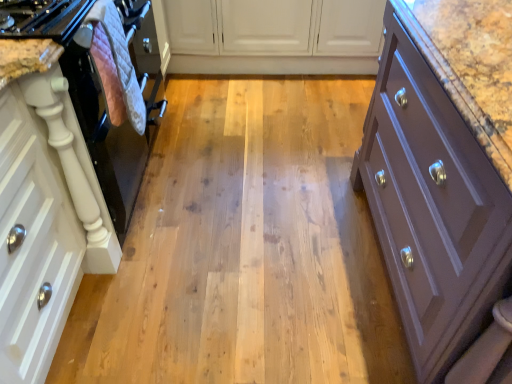
Question: Does pink quilted oven mitt at left have a larger size compared to white matte cabinet at left, which is counted as the third cabinetry, starting from the right?

Choices:
 (A) no
 (B) yes

Answer: (A)

Question: Is pink quilted oven mitt at left oriented away from white matte cabinet at left, which is counted as the first cabinetry, starting from the left?

Choices:
 (A) yes
 (B) no

Answer: (B)

Question: Can you confirm if pink quilted oven mitt at left is wider than white matte cabinet at left, which is counted as the third cabinetry, starting from the right?

Choices:
 (A) yes
 (B) no

Answer: (B)

Question: Is pink quilted oven mitt at left not near white matte cabinet at left, which is counted as the third cabinetry, starting from the right?

Choices:
 (A) yes
 (B) no

Answer: (B)

Question: From a real-world perspective, is pink quilted oven mitt at left located beneath white matte cabinet at left, which is counted as the first cabinetry, starting from the left?

Choices:
 (A) no
 (B) yes

Answer: (A)

Question: Looking at their shapes, would you say black glossy oven at left is wider or thinner than white matte cabinet at left, which is counted as the third cabinetry, starting from the right?

Choices:
 (A) wide
 (B) thin

Answer: (A)

Question: Based on their positions, is black glossy oven at left located to the left or right of white matte cabinet at left, which is counted as the third cabinetry, starting from the right?

Choices:
 (A) left
 (B) right

Answer: (B)

Question: Choose the correct answer: Is black glossy oven at left inside white matte cabinet at left, which is counted as the third cabinetry, starting from the right, or outside it?

Choices:
 (A) outside
 (B) inside

Answer: (A)

Question: From the image's perspective, is black glossy oven at left above or below white matte cabinet at left, which is counted as the first cabinetry, starting from the left?

Choices:
 (A) above
 (B) below

Answer: (A)

Question: From the image's perspective, relative to pink quilted oven mitt at left, is black glossy oven at left above or below?

Choices:
 (A) above
 (B) below

Answer: (A)

Question: In terms of size, does black glossy oven at left appear bigger or smaller than pink quilted oven mitt at left?

Choices:
 (A) small
 (B) big

Answer: (B)

Question: Is black glossy oven at left to the left or to the right of pink quilted oven mitt at left in the image?

Choices:
 (A) left
 (B) right

Answer: (A)

Question: In the image, is black glossy oven at left positioned in front of or behind pink quilted oven mitt at left?

Choices:
 (A) front
 (B) behind

Answer: (B)

Question: In the image, is white matte cabinet at center, which is the 2th cabinetry in right-to-left order, on the left side or the right side of white matte cabinet at left, which is counted as the third cabinetry, starting from the right?

Choices:
 (A) left
 (B) right

Answer: (B)

Question: From the image's perspective, is white matte cabinet at center, the second cabinetry from the left, located above or below white matte cabinet at left, which is counted as the third cabinetry, starting from the right?

Choices:
 (A) above
 (B) below

Answer: (A)